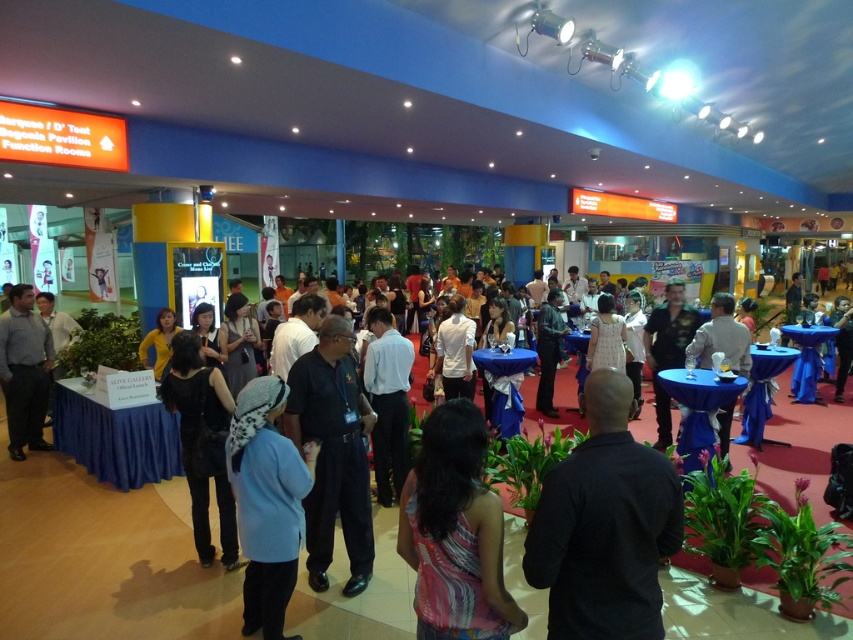
You are standing at the entrance of the hall and want to locate the person wearing the black matte shirt at center. According to the coordinates provided, in which direction should you look to find them?

The black matte shirt at center is located at coordinates point (604, 525), which means you should look towards the lower right direction from your current position at the entrance to find them.

You are at the event and want to find the black matte dress at lower left. Which direction should you look relative to the matte gray shirt at left?

The black matte dress at lower left is below the matte gray shirt at left, so you should look downward from the matte gray shirt at left to locate it.

You are attending the event and want to find the person wearing the dark blue uniform at center. Where should you look relative to the blue woolen hat at lower left?

The dark blue uniform at center is located to the right of the blue woolen hat at lower left, so you should look to the right side of the blue woolen hat at lower left to find the person in the dark blue uniform at center.